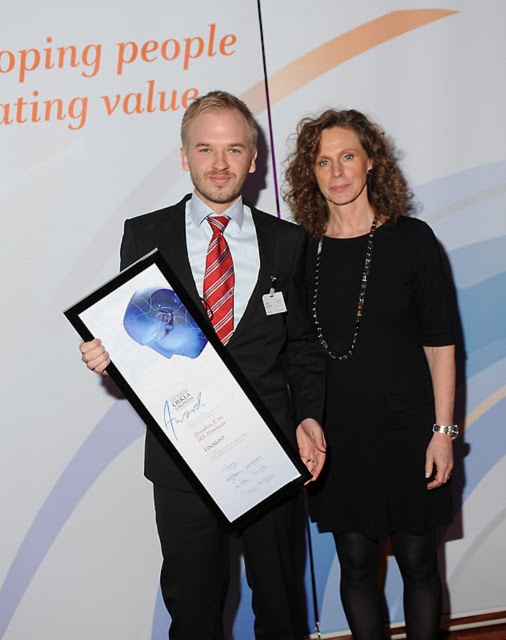
From the picture: You are an event planner organizing a ceremony where attendees must follow specific spatial arrangements. You need to place a podium for the speaker and a display stand for awards. Given the current setup shown in the image, where should you position the podium relative to the black matte dress at center and the matte black plaque at center?

The black matte dress at center is located above the matte black plaque at center. Therefore, the podium should be placed below the matte black plaque at center to align with the existing spatial arrangement.